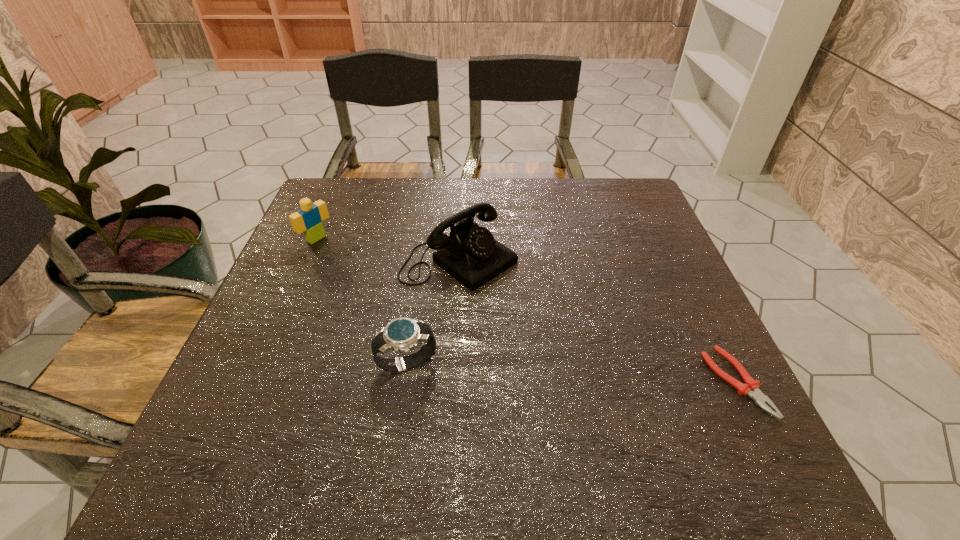
Where is `free space located on the front face of the telephone`? free space located on the front face of the telephone is located at coordinates (517, 296).

The image size is (960, 540). I want to click on vacant point located 0.150m on the front face of the telephone, so click(x=548, y=318).

Locate an element on the screen. free space located on the front face of the telephone is located at coordinates 617,369.

The width and height of the screenshot is (960, 540). In order to click on object located in the near edge section of the desktop in this screenshot , I will do `click(751, 388)`.

The image size is (960, 540). In order to click on object situated at the left edge in this screenshot , I will do `click(309, 219)`.

Identify the location of object located at the right edge. The height and width of the screenshot is (540, 960). (751, 388).

Where is `object at the near right corner`? This screenshot has height=540, width=960. object at the near right corner is located at coordinates (751, 388).

Find the location of `vacant space at the far edge of the desktop`. vacant space at the far edge of the desktop is located at coordinates (591, 214).

This screenshot has width=960, height=540. In the image, there is a desktop. Find the location of `free region at the near edge`. free region at the near edge is located at coordinates (348, 413).

Locate an element on the screen. vacant area at the left edge is located at coordinates (302, 308).